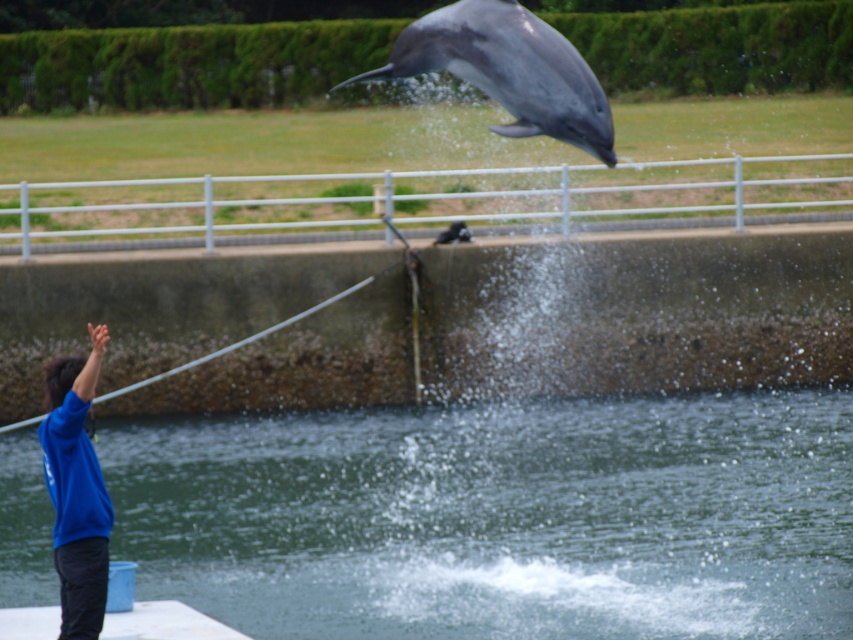
Does shiny gray dolphin at upper center have a smaller size compared to blue fleece at left?

Incorrect, shiny gray dolphin at upper center is not smaller in size than blue fleece at left.

Does shiny gray dolphin at upper center appear under blue fleece at left?

No, shiny gray dolphin at upper center is not below blue fleece at left.

Does point (503, 84) come behind point (67, 600)?

Yes, it is behind point (67, 600).

The height and width of the screenshot is (640, 853). Find the location of `shiny gray dolphin at upper center`. shiny gray dolphin at upper center is located at coordinates (508, 70).

Is clear water at lower center positioned in front of blue fleece at left?

No.

Does clear water at lower center appear over blue fleece at left?

No.

Who is more distant from viewer, (640, 612) or (74, 401)?

The point (640, 612) is behind.

Locate an element on the screen. The height and width of the screenshot is (640, 853). clear water at lower center is located at coordinates (498, 516).

Which is below, clear water at lower center or shiny gray dolphin at upper center?

clear water at lower center

Can you confirm if clear water at lower center is taller than shiny gray dolphin at upper center?

Incorrect, clear water at lower center's height is not larger of shiny gray dolphin at upper center's.

Which is in front, point (705, 449) or point (409, 72)?

Point (409, 72)

What are the coordinates of `clear water at lower center` in the screenshot? It's located at (498, 516).